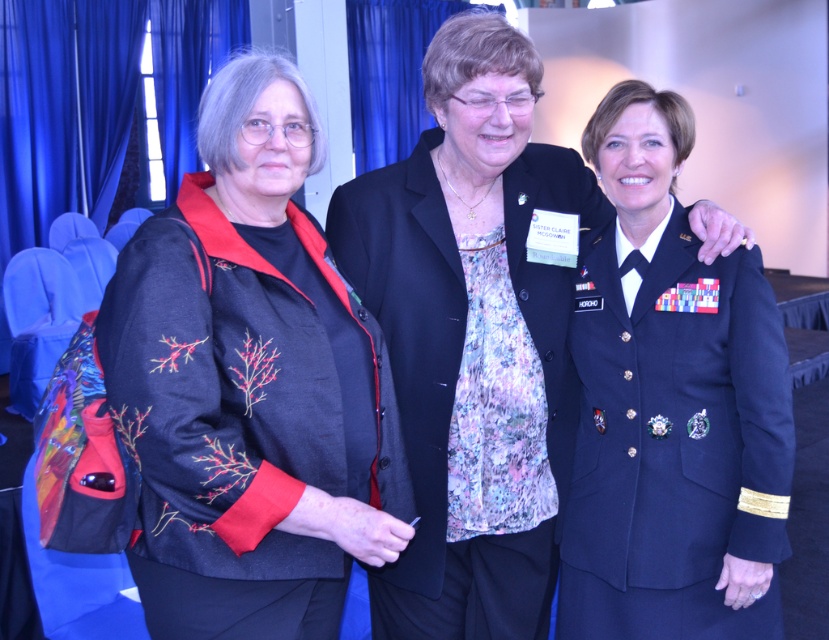
Question: Can you confirm if embroidered fabric jacket at center is bigger than navy blue fabric military uniform at center?

Choices:
 (A) no
 (B) yes

Answer: (B)

Question: Is navy blue fabric military uniform at right smaller than navy blue fabric military uniform at center?

Choices:
 (A) yes
 (B) no

Answer: (A)

Question: Which is nearer to the embroidered fabric jacket at center?

Choices:
 (A) navy blue fabric military uniform at center
 (B) navy blue fabric military uniform at right

Answer: (A)

Question: Which point is closer to the camera?

Choices:
 (A) navy blue fabric military uniform at right
 (B) embroidered fabric jacket at center
 (C) navy blue fabric military uniform at center

Answer: (B)

Question: Can you confirm if embroidered fabric jacket at center is positioned to the left of navy blue fabric military uniform at center?

Choices:
 (A) no
 (B) yes

Answer: (B)

Question: Which point is farther from the camera taking this photo?

Choices:
 (A) (716, 288)
 (B) (102, 305)
 (C) (432, 241)

Answer: (C)